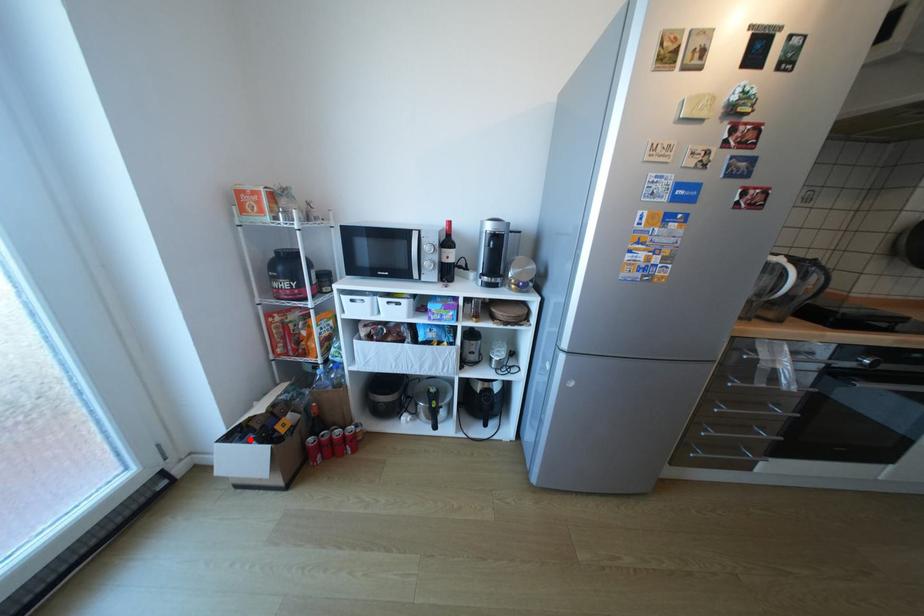
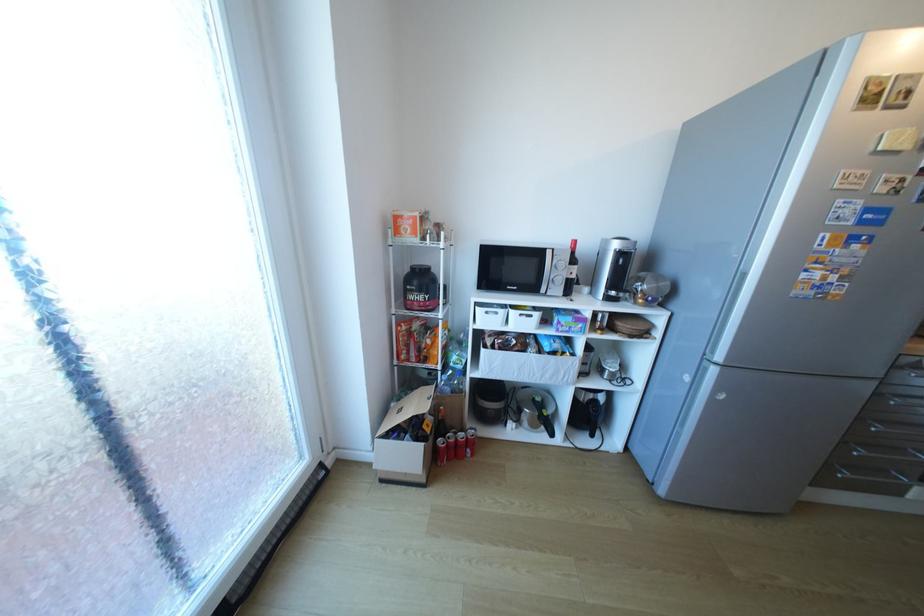
Question: A red point is marked in image1. In image2, is the corresponding 3D point closer to the camera or farther? Reply with the corresponding letter.

Choices:
 (A) The corresponding 3D point is closer.
 (B) The corresponding 3D point is farther.

Answer: (B)